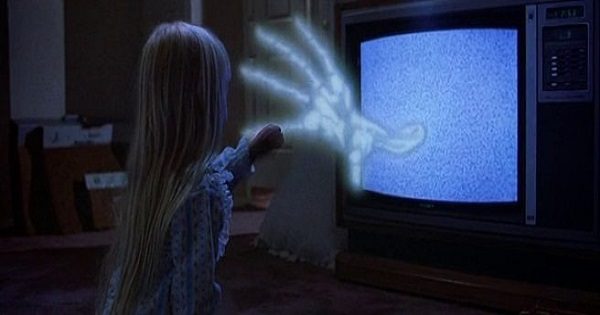
The height and width of the screenshot is (315, 600). Find the location of `dark wooden tiles`. dark wooden tiles is located at coordinates (74, 173), (104, 202), (30, 180).